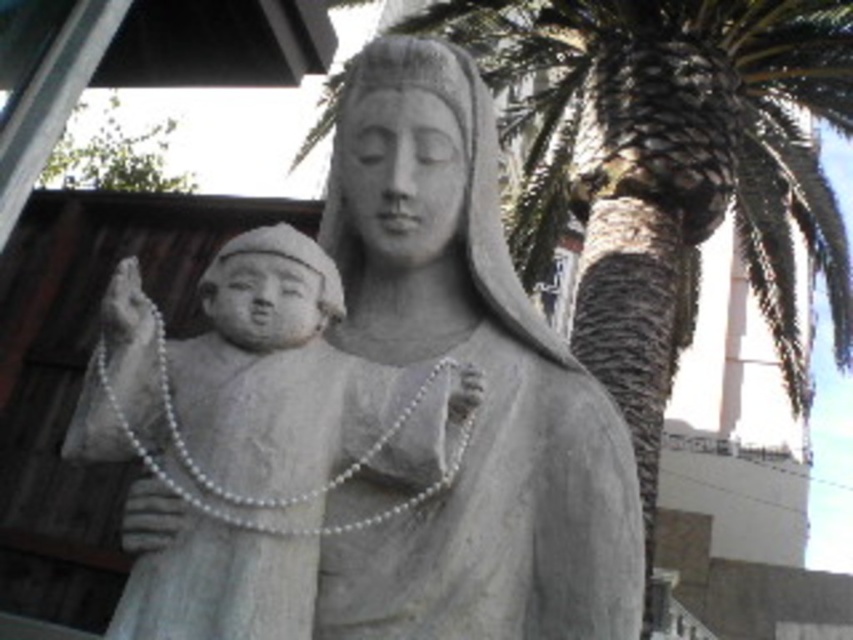
You are standing in front of the statue and want to take a photo. There are two points marked on the statue. One is at coordinates point (548, 140) and the other is at point (91, 452). Which point is closer to your camera lens?

Point (548, 140) is further to the camera than point (91, 452), so the point closer to your camera lens is point (91, 452).

You are standing at the point marked by the coordinates point (x=596, y=474). You want to take a photo of the statue of a figure holding a child in the scene. However, you need to ensure that the palm tree does not appear in the photo. Given your current position, can you determine if the palm tree will be visible in your photo?

Since you are standing at point (x=596, y=474) and the palm tree is part of the background in the scene, the distance between you and the palm tree is not specified. However, the distance between you and the viewer is 1.96 meters. Without information about the palm tree location relative to your position, it is impossible to determine if it will be visible in the photo.